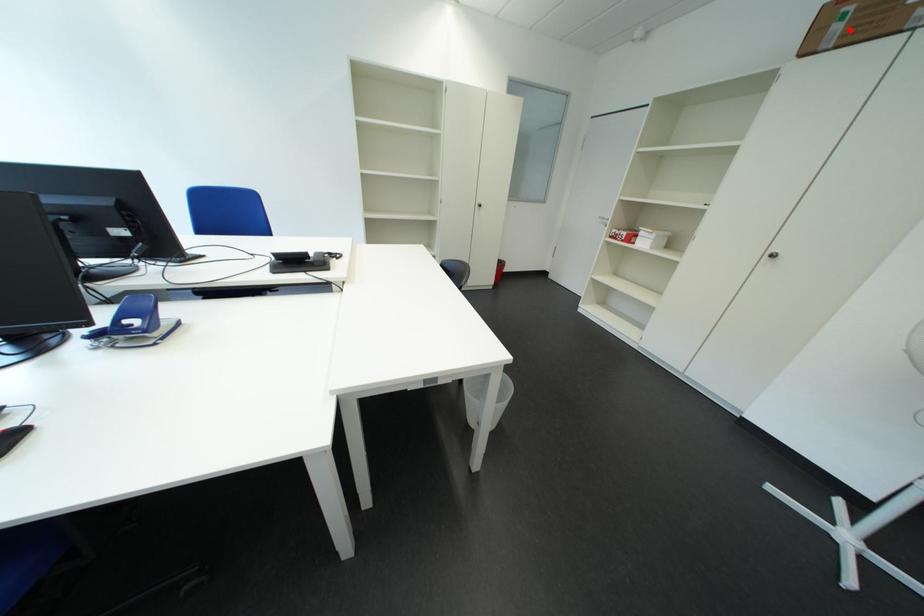
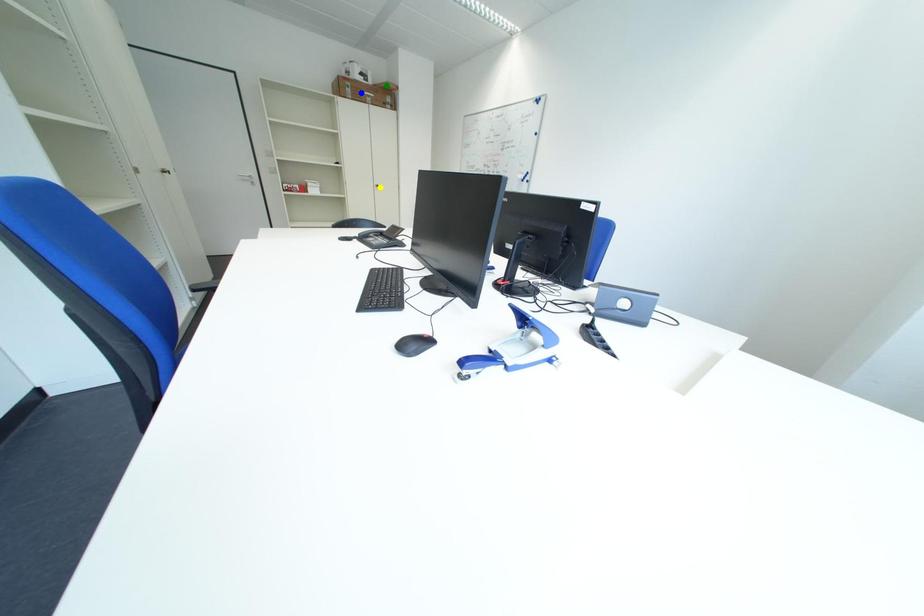
Question: I am providing you with two images of the same scene from different viewpoints. A red point is marked on the first image. You are given multiple points on the second image. Which spot in image 2 lines up with the point in image 1?

Choices:
 (A) green point
 (B) blue point
 (C) yellow point

Answer: (B)